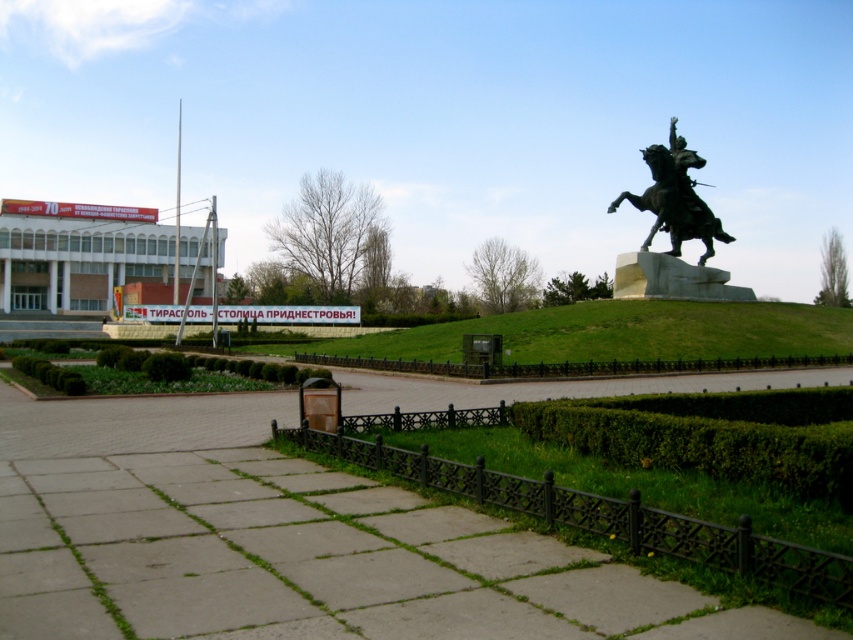
Question: Is green leafy hedge at lower right smaller than bronze metallic horse at upper right?

Choices:
 (A) no
 (B) yes

Answer: (B)

Question: Which of the following is the farthest from the observer?

Choices:
 (A) green grass at center
 (B) bronze metallic horse at upper right

Answer: (B)

Question: Among these points, which one is farthest from the camera?

Choices:
 (A) (747, 406)
 (B) (660, 193)

Answer: (B)

Question: Can you confirm if green leafy hedge at lower right is thinner than bronze metallic horse at upper right?

Choices:
 (A) yes
 (B) no

Answer: (A)

Question: Can you confirm if green leafy hedge at lower right is positioned below bronze metallic horse at upper right?

Choices:
 (A) yes
 (B) no

Answer: (A)

Question: Based on their relative distances, which object is farther from the bronze metallic horse at upper right?

Choices:
 (A) green grass at center
 (B) green shrubbery at lower left

Answer: (B)